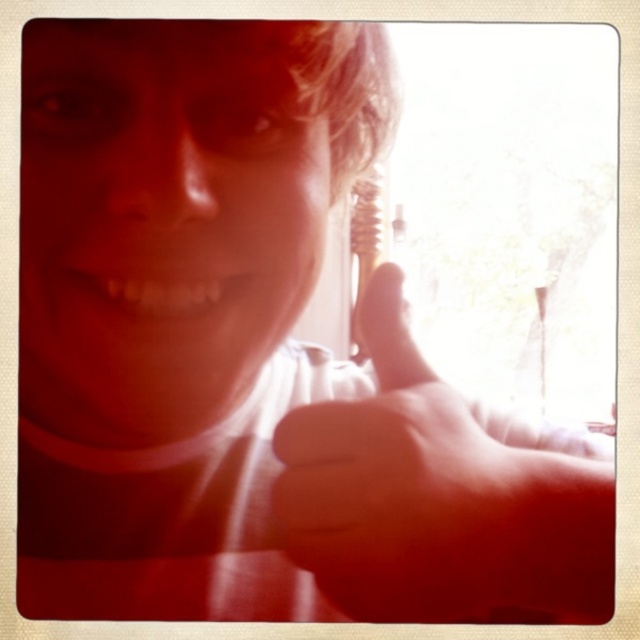
Question: Is smooth skin hand at center to the left of matte white teeth at center from the viewer's perspective?

Choices:
 (A) yes
 (B) no

Answer: (B)

Question: Can you confirm if smooth skin hand at center is positioned above matte white teeth at center?

Choices:
 (A) yes
 (B) no

Answer: (B)

Question: Which of the following is the farthest from the observer?

Choices:
 (A) (541, 588)
 (B) (97, 291)

Answer: (B)

Question: Which of the following is the farthest from the observer?

Choices:
 (A) (563, 515)
 (B) (93, 282)

Answer: (A)

Question: Is smooth skin hand at center thinner than matte white teeth at center?

Choices:
 (A) no
 (B) yes

Answer: (A)